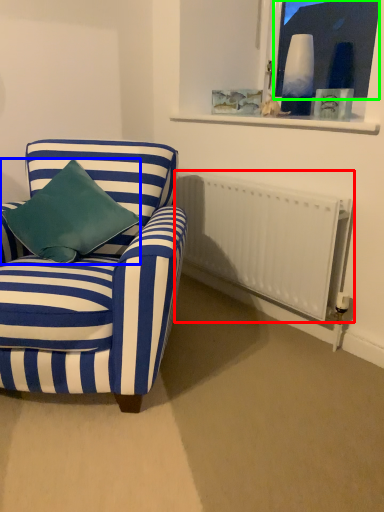
Question: Considering the real-world distances, which object is closest to radiator (highlighted by a red box)? pillow (highlighted by a blue box) or window screen (highlighted by a green box).

Choices:
 (A) pillow
 (B) window screen

Answer: (A)